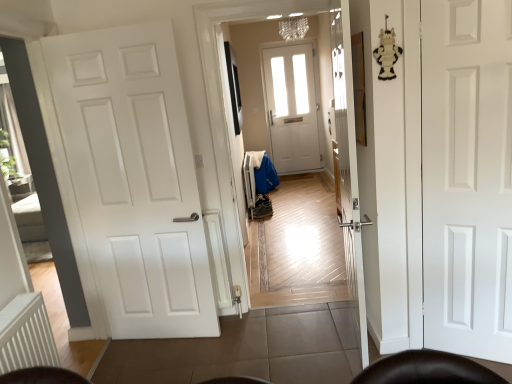
Question: Is white matte door at right, which is the 2th door in left-to-right order, surrounded by white ribbed radiator at lower left?

Choices:
 (A) yes
 (B) no

Answer: (B)

Question: Can you confirm if white ribbed radiator at lower left is thinner than white matte door at right, acting as the 1th door starting from the right?

Choices:
 (A) no
 (B) yes

Answer: (A)

Question: Is white ribbed radiator at lower left at the left side of white matte door at right, which is the 2th door in left-to-right order?

Choices:
 (A) no
 (B) yes

Answer: (B)

Question: From the image's perspective, is white ribbed radiator at lower left located above white matte door at right, acting as the 1th door starting from the right?

Choices:
 (A) no
 (B) yes

Answer: (A)

Question: Is white ribbed radiator at lower left completely or partially outside of white matte door at right, acting as the 1th door starting from the right?

Choices:
 (A) no
 (B) yes

Answer: (B)

Question: Can you confirm if white ribbed radiator at lower left is bigger than white matte door at right, which is the 2th door in left-to-right order?

Choices:
 (A) yes
 (B) no

Answer: (B)

Question: From a real-world perspective, does white matte door at left, acting as the 1th door starting from the left, stand above white ribbed radiator at lower left?

Choices:
 (A) no
 (B) yes

Answer: (B)

Question: Can you confirm if white matte door at left, acting as the 1th door starting from the left, is taller than white ribbed radiator at lower left?

Choices:
 (A) yes
 (B) no

Answer: (A)

Question: Is white matte door at left, which is the 2th door from right to left, thinner than white ribbed radiator at lower left?

Choices:
 (A) yes
 (B) no

Answer: (A)

Question: Can you confirm if white matte door at left, which is the 2th door from right to left, is wider than white ribbed radiator at lower left?

Choices:
 (A) yes
 (B) no

Answer: (B)

Question: Can white ribbed radiator at lower left be found inside white matte door at left, acting as the 1th door starting from the left?

Choices:
 (A) no
 (B) yes

Answer: (A)

Question: Does white matte door at left, acting as the 1th door starting from the left, appear on the left side of white ribbed radiator at lower left?

Choices:
 (A) no
 (B) yes

Answer: (A)

Question: Is white matte door at left, acting as the 1th door starting from the left, in front of white matte door at right, acting as the 1th door starting from the right?

Choices:
 (A) yes
 (B) no

Answer: (B)